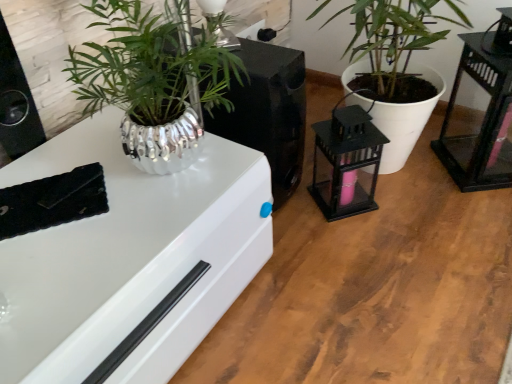
The image size is (512, 384). In order to click on vacant area situated below black glass table at right (from a real-world perspective) in this screenshot , I will do `click(464, 162)`.